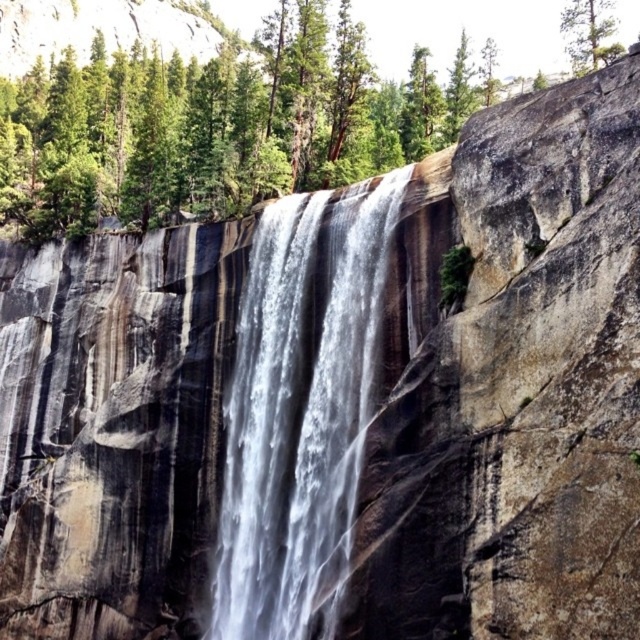
You are a bird seeking shelter. You see a green leafy tree at center and a white smooth waterfall at center. Which location would provide more coverage from the rain?

The green leafy tree at center is larger in size than the white smooth waterfall at center, so the green leafy tree at center would provide more coverage from the rain.

You are a hiker standing at the base of the white smooth waterfall at center and want to take a photo of the green leafy tree at center. Which direction should you face to ensure the tree is fully visible in the frame?

Since the green leafy tree at center has a greater height compared to the white smooth waterfall at center, you should face away from the waterfall towards the tree to ensure its full height is visible in your photo.

You are standing at the base of the waterfall and want to take a photo. There are two points marked in the scene, point A at coordinates point (x=45, y=64) and point B at coordinates point (x=333, y=428). Which point is closer to your camera lens?

Point A at coordinates point (x=45, y=64) is closer to the camera lens because it is further to the camera than point B at coordinates point (x=333, y=428).